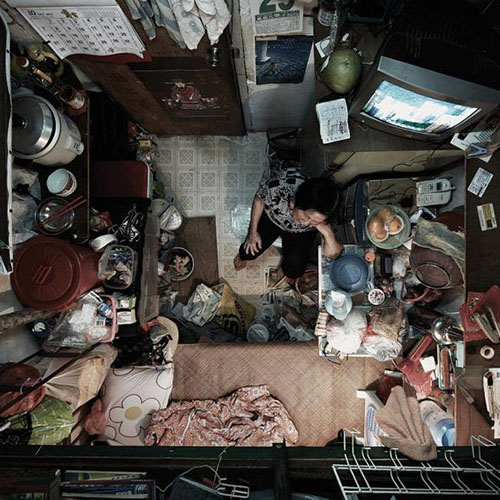
You are a GUI agent. You are given a task and a screenshot of the screen. Output one action in this format:
    pyautogui.click(x=<x>, y=<y>)
    Task: Click on the chopsticks
    
    Given the screenshot: What is the action you would take?
    pyautogui.click(x=72, y=205)